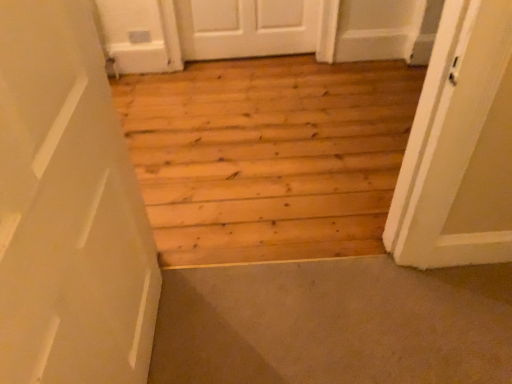
The width and height of the screenshot is (512, 384). Identify the location of free point above carpeted stairwell at lower left (from a real-world perspective). (313, 322).